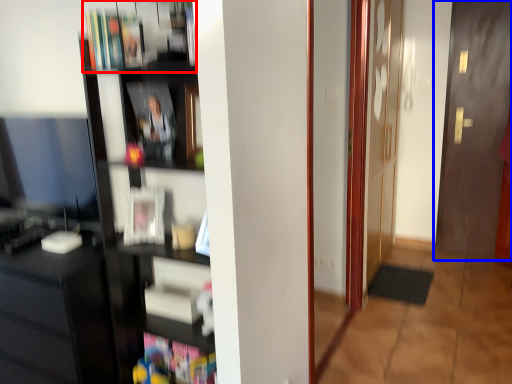
Question: Which object appears closest to the camera in this image, book (highlighted by a red box) or door (highlighted by a blue box)?

Choices:
 (A) book
 (B) door

Answer: (A)